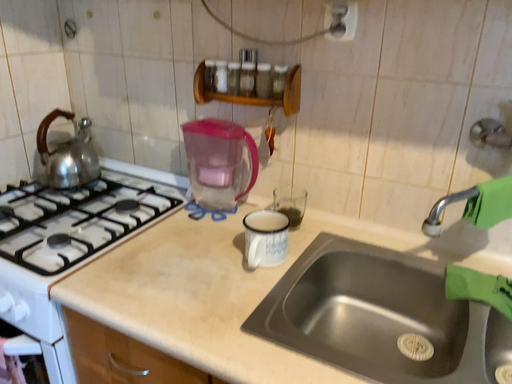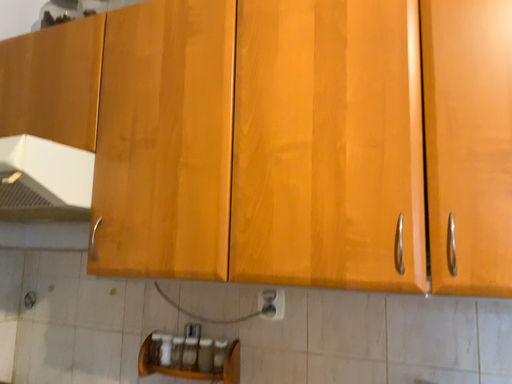
Question: How did the camera likely rotate when shooting the video?

Choices:
 (A) rotated upward
 (B) rotated downward

Answer: (A)